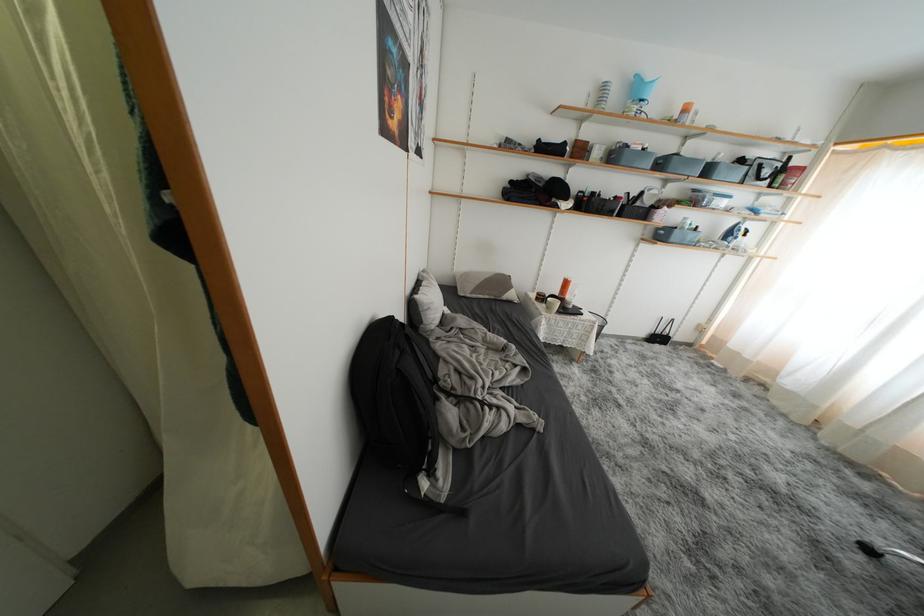
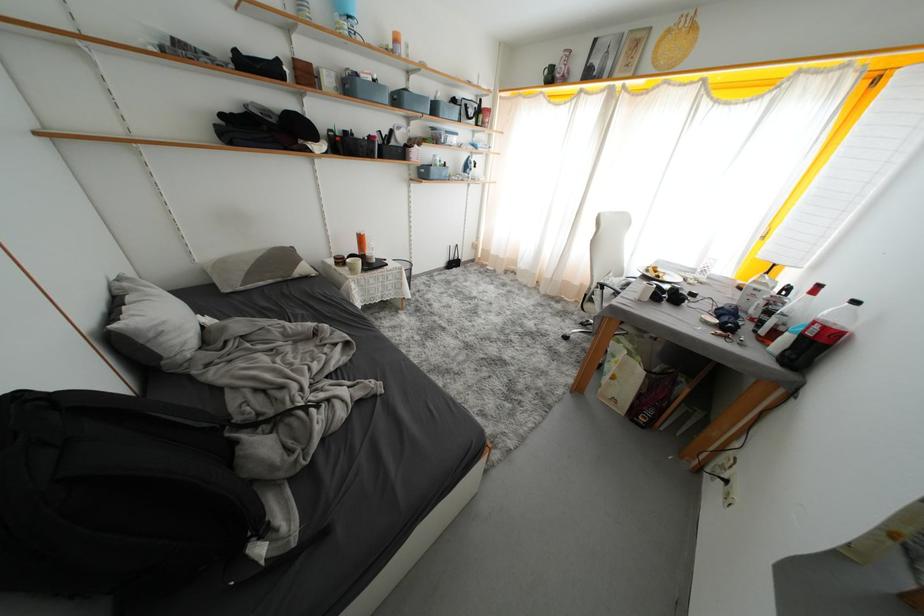
The point at [667,168] is marked in the first image. Where is the corresponding point in the second image?

(404, 103)